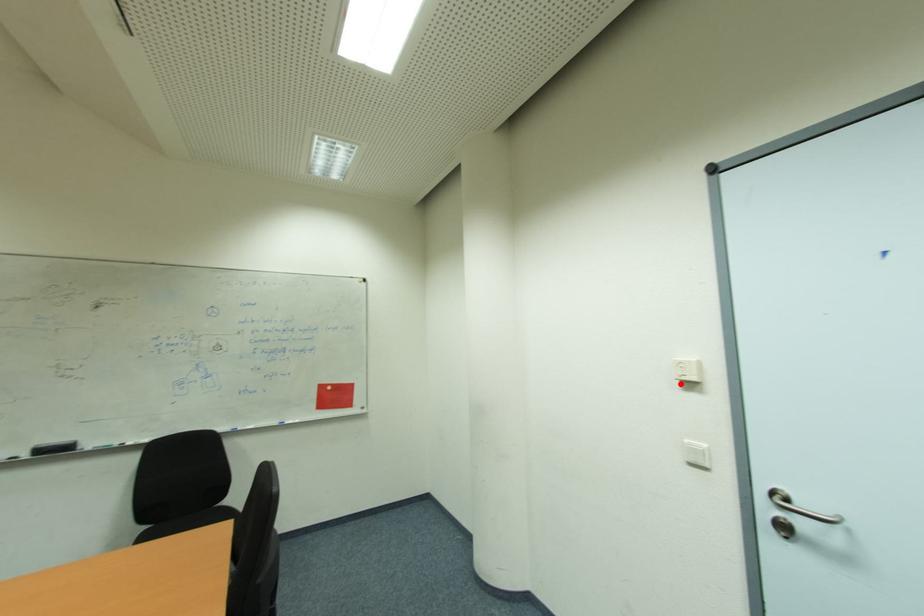
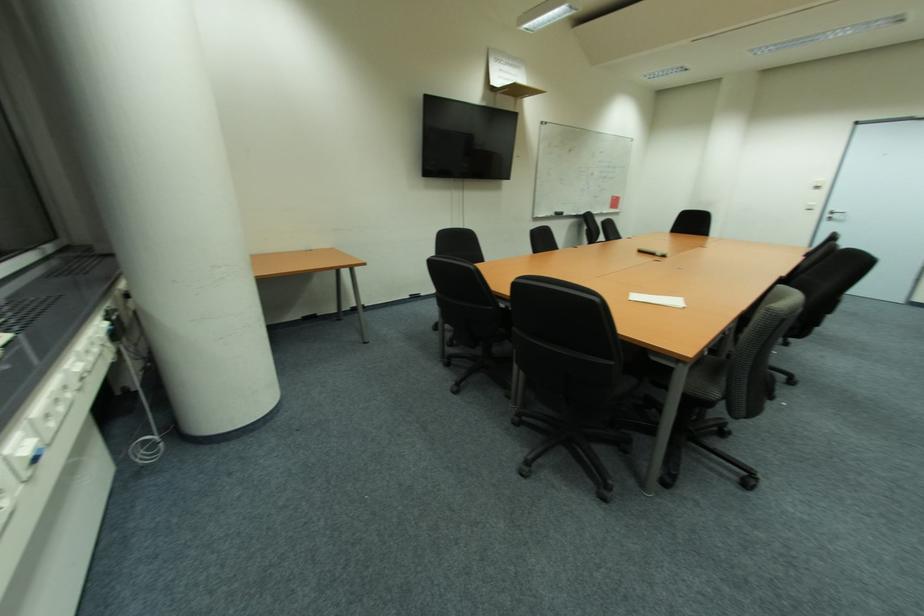
The point at the highlighted location is marked in the first image. Where is the corresponding point in the second image?

(820, 188)